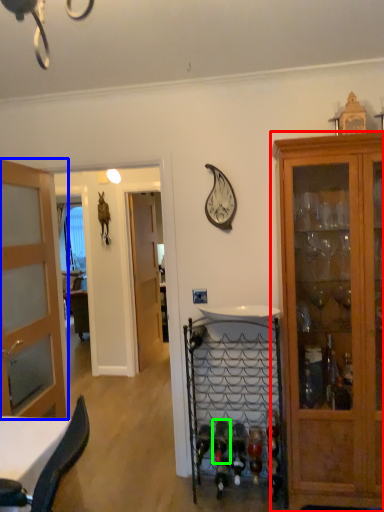
Question: Considering the real-world distances, which object is closest to cabinetry (highlighted by a red box)? door (highlighted by a blue box) or wine bottle (highlighted by a green box).

Choices:
 (A) door
 (B) wine bottle

Answer: (B)